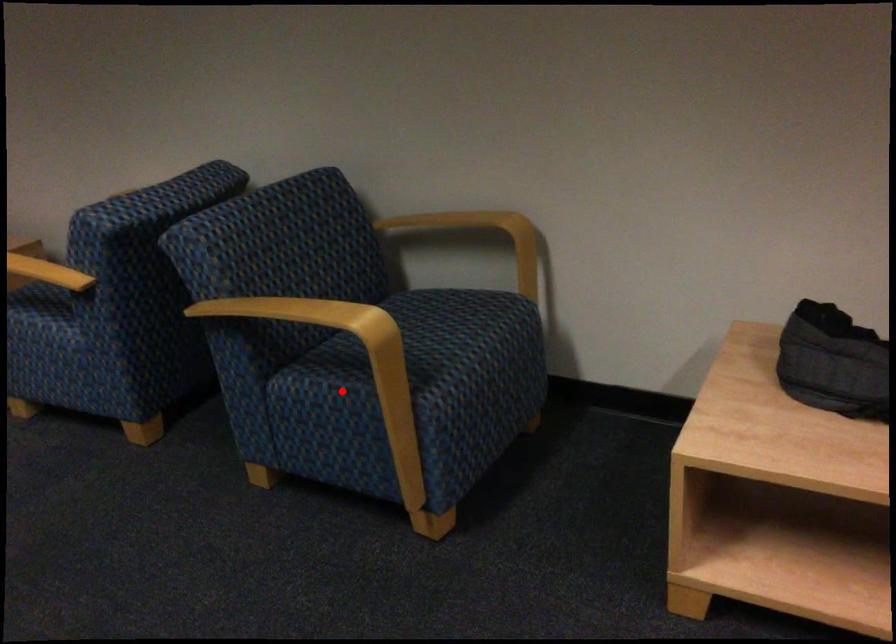
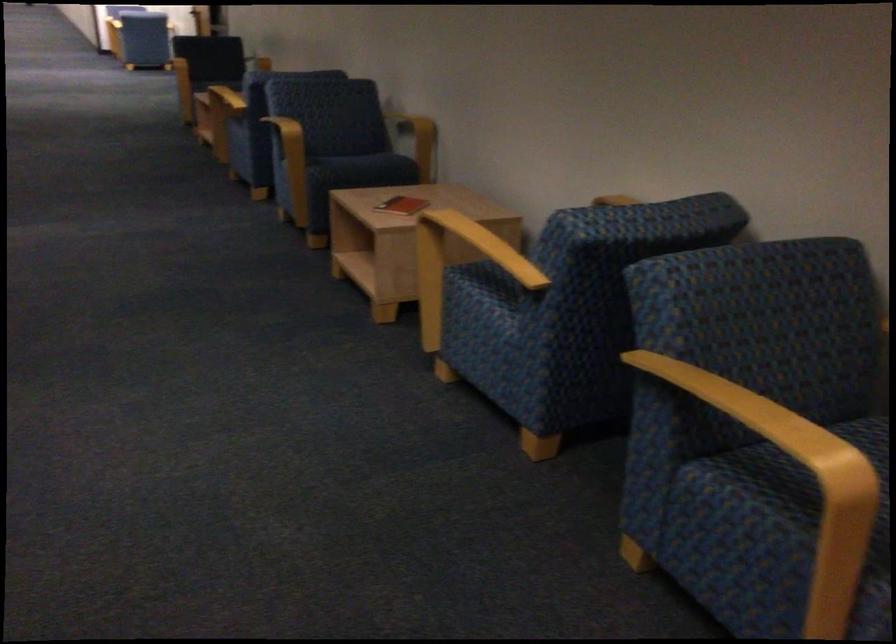
Locate, in the second image, the point that corresponds to the highlighted location in the first image.

(763, 515)